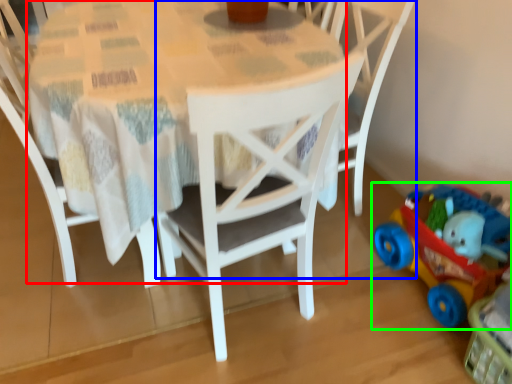
Question: Which object is the closest to the round table (highlighted by a red box)? Choose among these: chair (highlighted by a blue box) or toy (highlighted by a green box).

Choices:
 (A) chair
 (B) toy

Answer: (A)